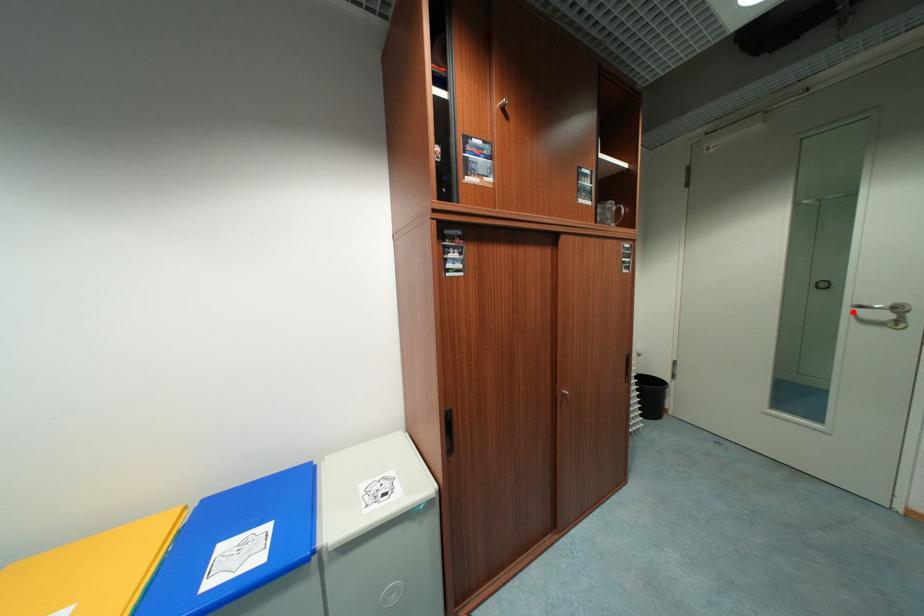
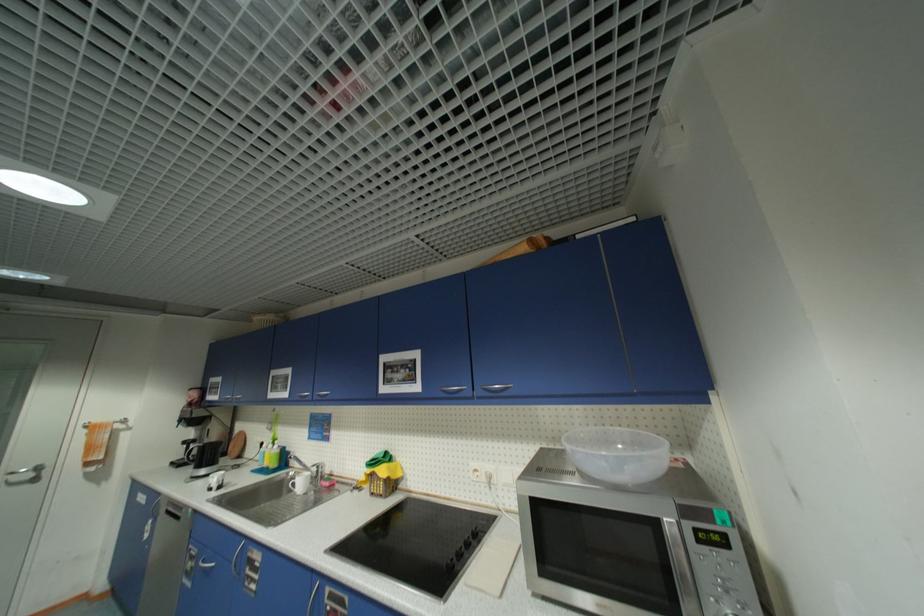
Question: I am providing you with two images of the same scene from different viewpoints. A red point is shown in image1. For the corresponding object point in image2, is it positioned nearer or farther from the camera?

Choices:
 (A) Nearer
 (B) Farther

Answer: (A)